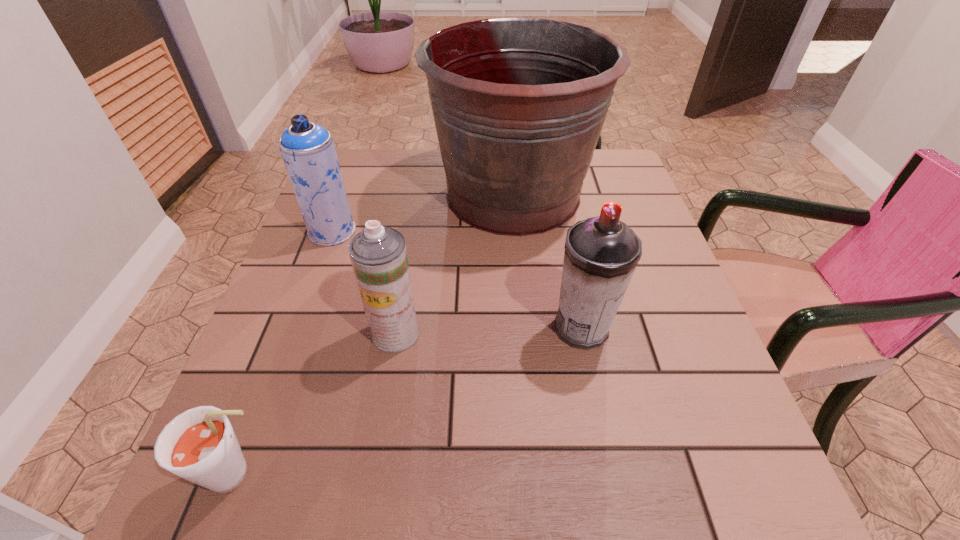
Locate an element on the screen. the tallest object is located at coordinates (519, 104).

Find the location of `the farthest aerosol can`. the farthest aerosol can is located at coordinates (308, 151).

In order to click on the rightmost aerosol can in this screenshot , I will do `click(601, 253)`.

Where is `the second aerosol can from right to left`? The height and width of the screenshot is (540, 960). the second aerosol can from right to left is located at coordinates (378, 254).

Identify the location of the nearest object. Image resolution: width=960 pixels, height=540 pixels. (199, 445).

At what (x,y) coordinates should I click in order to perform the action: click on root beer. Please return your answer as a coordinate pair (x, y). The height and width of the screenshot is (540, 960). Looking at the image, I should click on (199, 445).

This screenshot has height=540, width=960. Find the location of `vacant space situated on the left of the bucket`. vacant space situated on the left of the bucket is located at coordinates (364, 194).

You are a GUI agent. You are given a task and a screenshot of the screen. Output one action in this format:
    pyautogui.click(x=<x>, y=<y>)
    Task: Click on the vacant region located 0.170m on the back of the leftmost aerosol can
    
    Given the screenshot: What is the action you would take?
    pyautogui.click(x=351, y=179)

Identify the location of free location located on the left of the rightmost aerosol can. The image size is (960, 540). pos(498,328).

In order to click on vacant region located 0.200m on the right of the second aerosol can from left to right in this screenshot , I will do `click(525, 333)`.